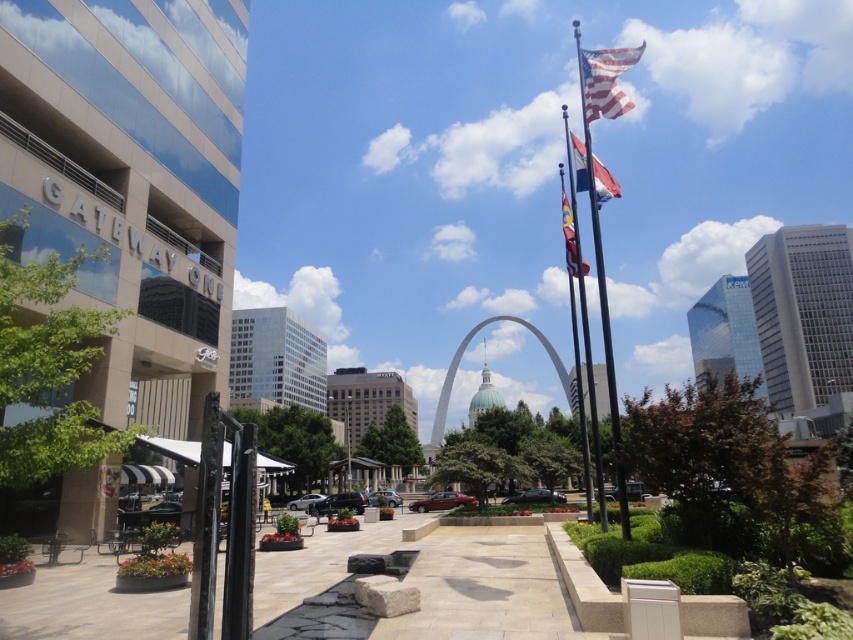
What do you see at coordinates (602, 182) in the screenshot? This screenshot has height=640, width=853. I see `polyester flag at upper center` at bounding box center [602, 182].

Can you confirm if polyester flag at upper center is shorter than silky blue flag at upper center?

Yes.

Does point (593, 182) come in front of point (582, 272)?

That is True.

Find the location of a particular element. The image size is (853, 640). polyester flag at upper center is located at coordinates (602, 182).

Is metallic flag pole at upper right positioned at the back of american flag at upper right?

No.

Does metallic flag pole at upper right have a smaller size compared to american flag at upper right?

No, metallic flag pole at upper right is not smaller than american flag at upper right.

Image resolution: width=853 pixels, height=640 pixels. What do you see at coordinates (599, 204) in the screenshot? I see `metallic flag pole at upper right` at bounding box center [599, 204].

Locate an element on the screen. metallic flag pole at upper right is located at coordinates (599, 204).

Who is positioned more to the left, american flag at upper right or polyester flag at upper center?

Positioned to the left is polyester flag at upper center.

Who is taller, american flag at upper right or polyester flag at upper center?

Standing taller between the two is american flag at upper right.

Where is `american flag at upper right`? The width and height of the screenshot is (853, 640). american flag at upper right is located at coordinates (606, 81).